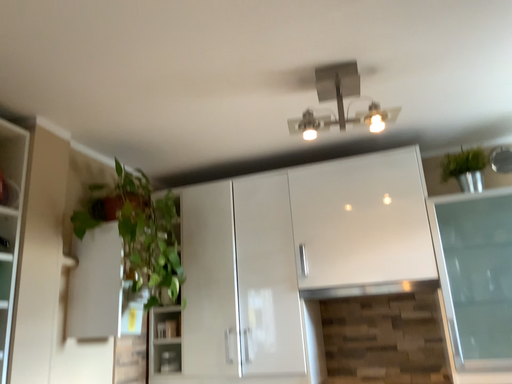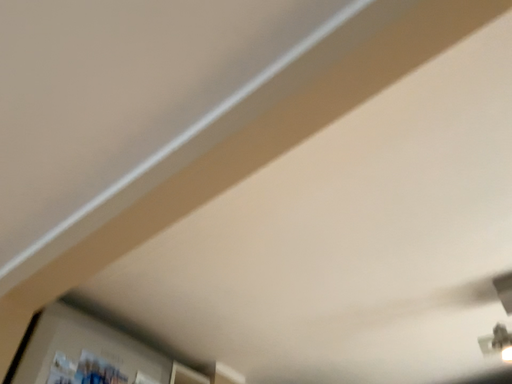
Question: Which way did the camera rotate in the video?

Choices:
 (A) rotated downward
 (B) rotated upward

Answer: (B)